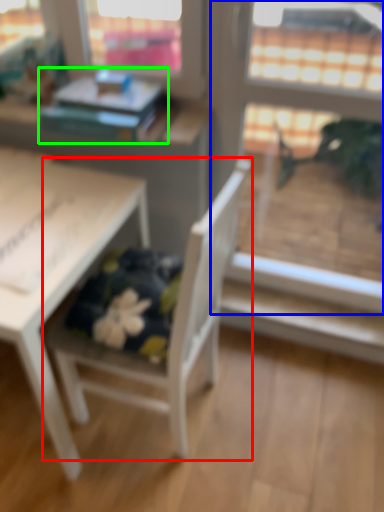
Question: Which is farther away from chair (highlighted by a red box)? screen door (highlighted by a blue box) or book (highlighted by a green box)?

Choices:
 (A) screen door
 (B) book

Answer: (A)